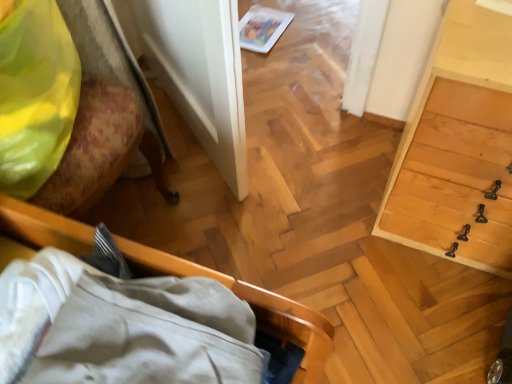
Identify the location of vacant space in front of light wood dresser at right. (426, 319).